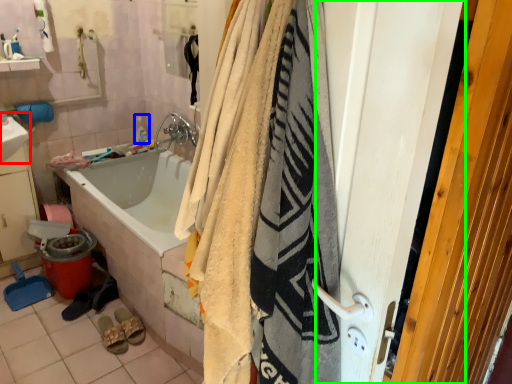
Question: Which object is the closest to the sink (highlighted by a red box)? Choose among these: toiletry (highlighted by a blue box) or screen door (highlighted by a green box).

Choices:
 (A) toiletry
 (B) screen door

Answer: (A)